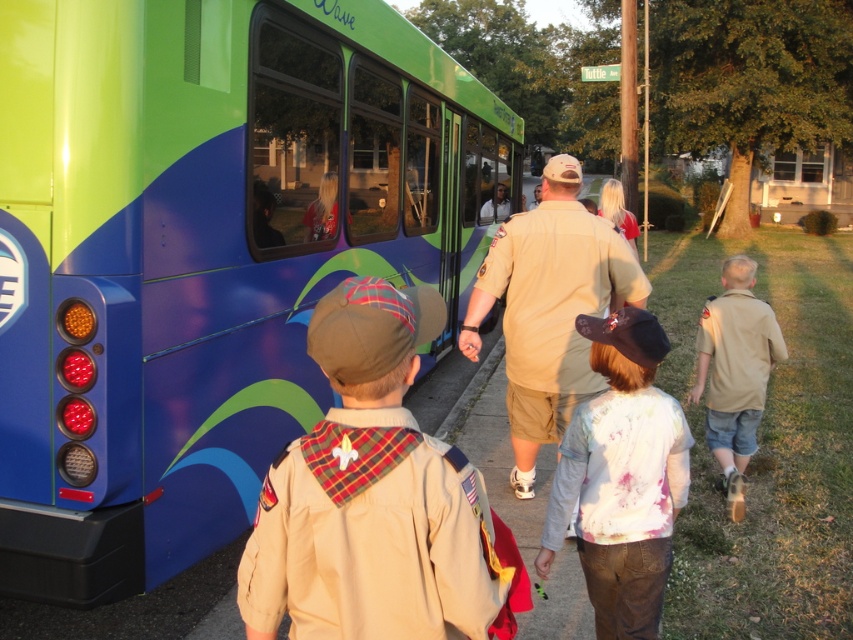
Question: Is tan uniform at center further to camera compared to tan uniform at lower right?

Choices:
 (A) yes
 (B) no

Answer: (B)

Question: Is khaki uniform at center below tan uniform at center?

Choices:
 (A) no
 (B) yes

Answer: (B)

Question: Which point is farther to the camera?

Choices:
 (A) (76, 518)
 (B) (312, 532)
 (C) (549, 438)

Answer: (C)

Question: Can you confirm if tie-dye fabric shirt at center is positioned below tan uniform at lower right?

Choices:
 (A) no
 (B) yes

Answer: (B)

Question: Which object is farther from the camera taking this photo?

Choices:
 (A) tan uniform at center
 (B) tie-dye fabric shirt at center

Answer: (A)

Question: Estimate the real-world distances between objects in this image. Which object is closer to the shiny red jacket at bus window?

Choices:
 (A) green matte bus at left
 (B) tie-dye fabric shirt at center
 (C) khaki uniform at center
 (D) tan uniform at lower right

Answer: (A)